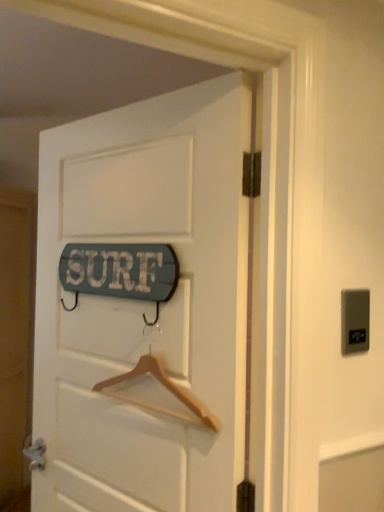
Question: Is wooden signboard at center facing away from gray plastic electric outlet at upper right?

Choices:
 (A) yes
 (B) no

Answer: (B)

Question: Can you confirm if wooden signboard at center is wider than gray plastic electric outlet at upper right?

Choices:
 (A) yes
 (B) no

Answer: (A)

Question: From a real-world perspective, is wooden signboard at center over gray plastic electric outlet at upper right?

Choices:
 (A) no
 (B) yes

Answer: (A)

Question: Is wooden signboard at center facing towards gray plastic electric outlet at upper right?

Choices:
 (A) yes
 (B) no

Answer: (B)

Question: Can you confirm if wooden signboard at center is bigger than gray plastic electric outlet at upper right?

Choices:
 (A) yes
 (B) no

Answer: (A)

Question: Is wooden signboard at center thinner than gray plastic electric outlet at upper right?

Choices:
 (A) no
 (B) yes

Answer: (A)

Question: From a real-world perspective, is wooden hanger at center physically above wooden signboard at center?

Choices:
 (A) yes
 (B) no

Answer: (B)

Question: Is wooden hanger at center at the right side of wooden signboard at center?

Choices:
 (A) yes
 (B) no

Answer: (A)

Question: Is the position of wooden hanger at center less distant than that of wooden signboard at center?

Choices:
 (A) yes
 (B) no

Answer: (B)

Question: Can you confirm if wooden hanger at center is taller than wooden signboard at center?

Choices:
 (A) no
 (B) yes

Answer: (A)

Question: Does wooden hanger at center have a smaller size compared to wooden signboard at center?

Choices:
 (A) yes
 (B) no

Answer: (A)

Question: Is wooden hanger at center further to camera compared to wooden signboard at center?

Choices:
 (A) no
 (B) yes

Answer: (B)

Question: From a real-world perspective, is gray plastic electric outlet at upper right located beneath wooden signboard at center?

Choices:
 (A) yes
 (B) no

Answer: (B)